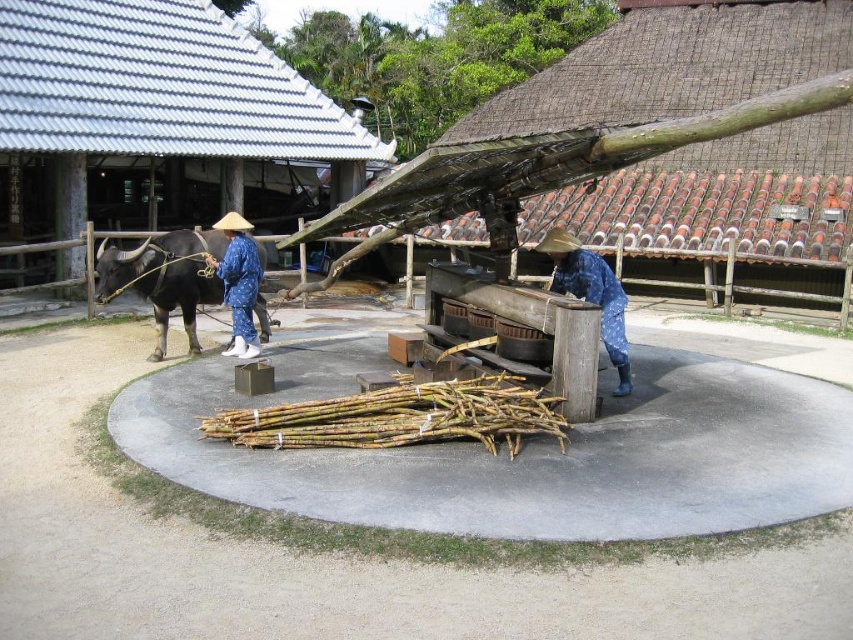
In the rural scene, you need to determine which object is wider between the blue dotted fabric at center and the blue fabric hat at center. Please state which one is wider based on their positions and sizes in the image.

The blue dotted fabric at center is wider than the blue fabric hat at center as per the description provided.